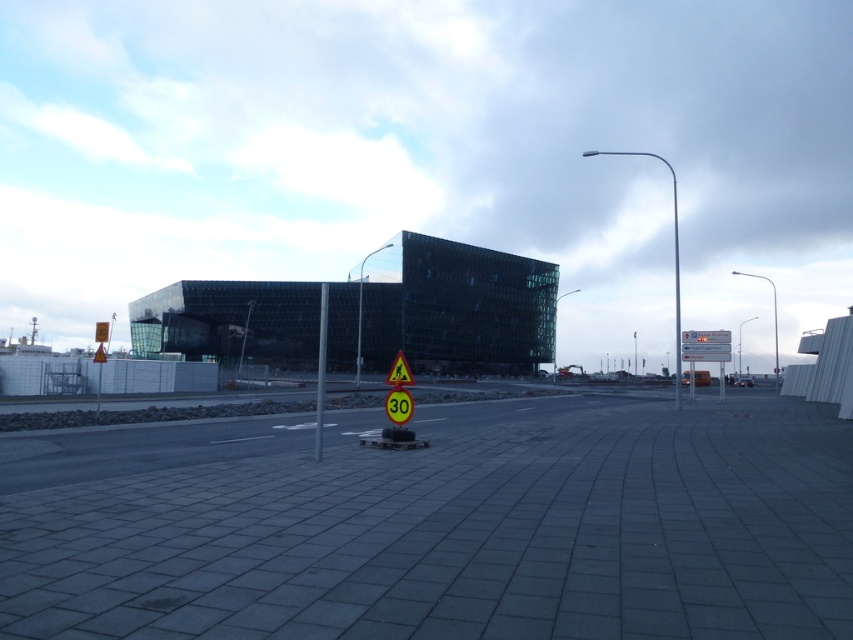
Does point (236, 508) lie behind point (405, 422)?

No, it is not.

This screenshot has width=853, height=640. In order to click on gray concrete pavement at center in this screenshot , I will do `click(440, 525)`.

Between metallic pole at center and yellow reflective triangle at center, which one is positioned lower?

Positioned lower is yellow reflective triangle at center.

Between point (317, 454) and point (399, 385), which one is positioned behind?

Positioned behind is point (399, 385).

Is point (323, 310) less distant than point (399, 355)?

Yes, point (323, 310) is closer to viewer.

Locate an element on the screen. The width and height of the screenshot is (853, 640). metallic pole at center is located at coordinates (321, 369).

Which is in front, point (344, 499) or point (405, 358)?

Point (344, 499) is in front.

Does gray concrete pavement at center appear over yellow reflective triangle at center?

No.

What do you see at coordinates (440, 525) in the screenshot? I see `gray concrete pavement at center` at bounding box center [440, 525].

Locate an element on the screen. gray concrete pavement at center is located at coordinates tap(440, 525).